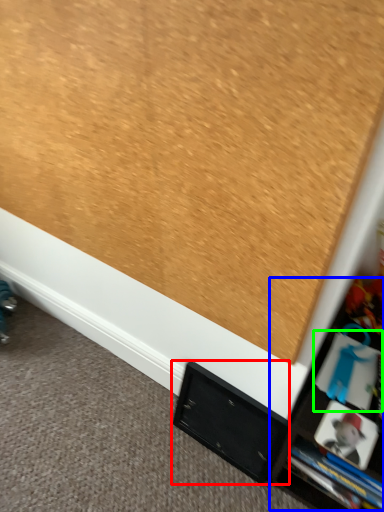
Question: Which object is the farthest from cabinet (highlighted by a red box)? Choose among these: tv cabinet (highlighted by a blue box) or book (highlighted by a green box).

Choices:
 (A) tv cabinet
 (B) book

Answer: (B)